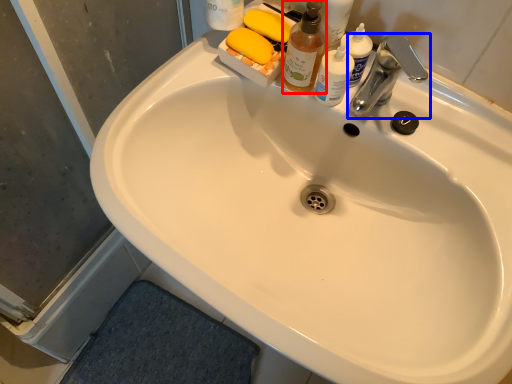
Question: Among these objects, which one is nearest to the camera, cleaning product (highlighted by a red box) or tap (highlighted by a blue box)?

Choices:
 (A) cleaning product
 (B) tap

Answer: (A)